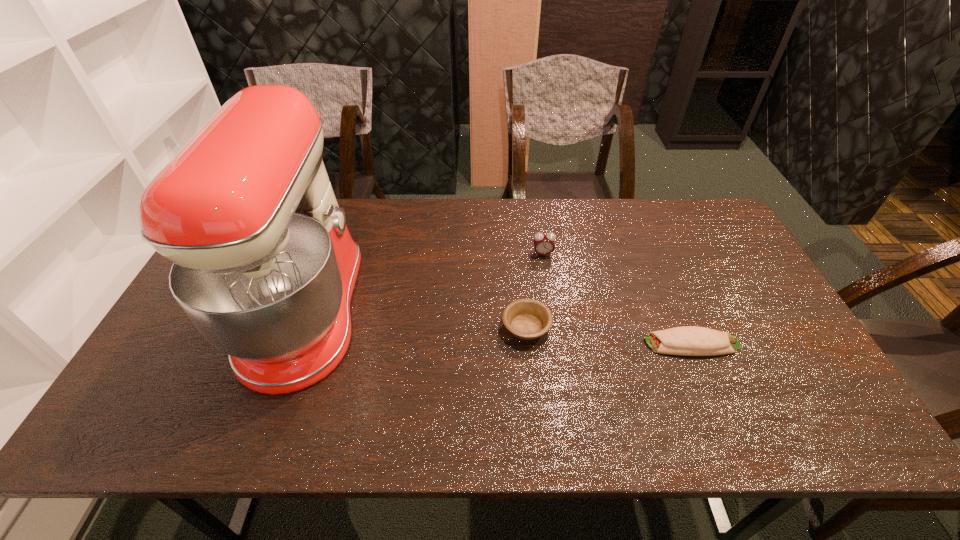
This screenshot has width=960, height=540. I want to click on free point between the third tallest object and the rightmost object, so click(609, 335).

Identify the location of vacant point located between the leftmost object and the shortest object. (499, 328).

Where is `free space between the tallest object and the third shortest object`? The width and height of the screenshot is (960, 540). free space between the tallest object and the third shortest object is located at coordinates (424, 283).

Where is `vacant region between the mixer and the bowl`? Image resolution: width=960 pixels, height=540 pixels. vacant region between the mixer and the bowl is located at coordinates 417,320.

Identify the location of empty location between the burrito and the second tallest object. The width and height of the screenshot is (960, 540). (617, 299).

Locate an element on the screen. unoccupied position between the rightmost object and the bowl is located at coordinates (609, 335).

Find the location of a particular element. free space between the mixer and the second shortest object is located at coordinates (417, 320).

Select which object appears as the second closest to the leftmost object. Please provide its 2D coordinates. Your answer should be formatted as a tuple, i.e. [(x, y)], where the tuple contains the x and y coordinates of a point satisfying the conditions above.

[(543, 243)]

This screenshot has width=960, height=540. Find the location of `object that is the second closest one to the tallest object`. object that is the second closest one to the tallest object is located at coordinates pos(543,243).

You are a GUI agent. You are given a task and a screenshot of the screen. Output one action in this format:
    pyautogui.click(x=<x>, y=<y>)
    Task: Click on the free location that satisfies the following two spatial constraints: 1. on the clock face of the third shortest object; 2. on the front-facing side of the leftmost object
    This screenshot has height=540, width=960.
    Given the screenshot: What is the action you would take?
    pyautogui.click(x=551, y=312)